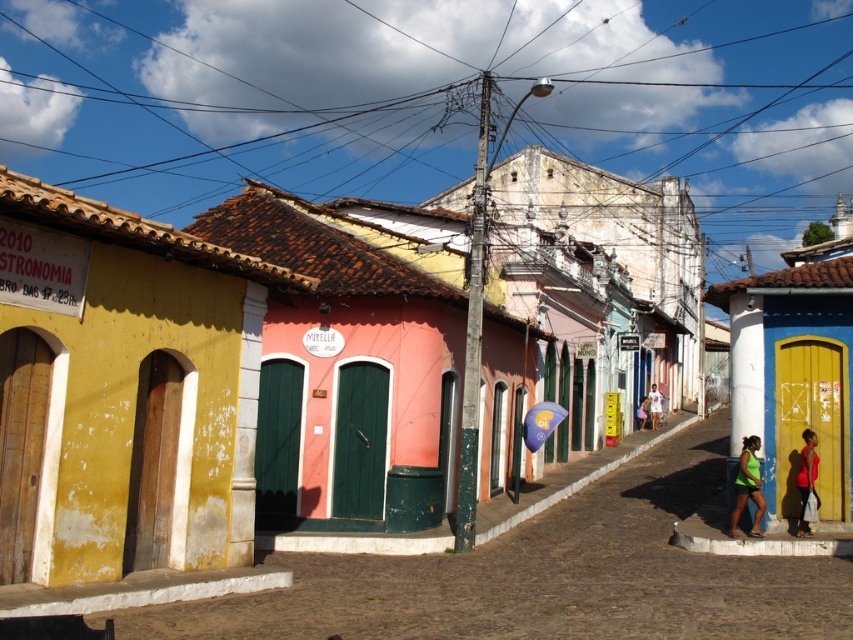
Question: Is green matte tank top at lower right bigger than red fabric shirt at lower right?

Choices:
 (A) yes
 (B) no

Answer: (A)

Question: Which object appears closest to the camera in this image?

Choices:
 (A) green matte tank top at lower right
 (B) brown wire at upper center
 (C) red fabric shirt at lower right
 (D) white matte shirt at center

Answer: (C)

Question: Which is nearer to the brown wire at upper center?

Choices:
 (A) white matte shirt at center
 (B) matte pink shirt at center
 (C) red fabric shirt at lower right

Answer: (A)

Question: Does green matte tank top at lower right have a smaller size compared to red fabric shirt at lower right?

Choices:
 (A) no
 (B) yes

Answer: (A)

Question: Is green matte tank top at lower right closer to camera compared to matte pink shirt at center?

Choices:
 (A) yes
 (B) no

Answer: (A)

Question: Which object is farther from the camera taking this photo?

Choices:
 (A) red fabric shirt at lower right
 (B) white matte shirt at center
 (C) green matte tank top at lower right
 (D) brown wire at upper center

Answer: (D)